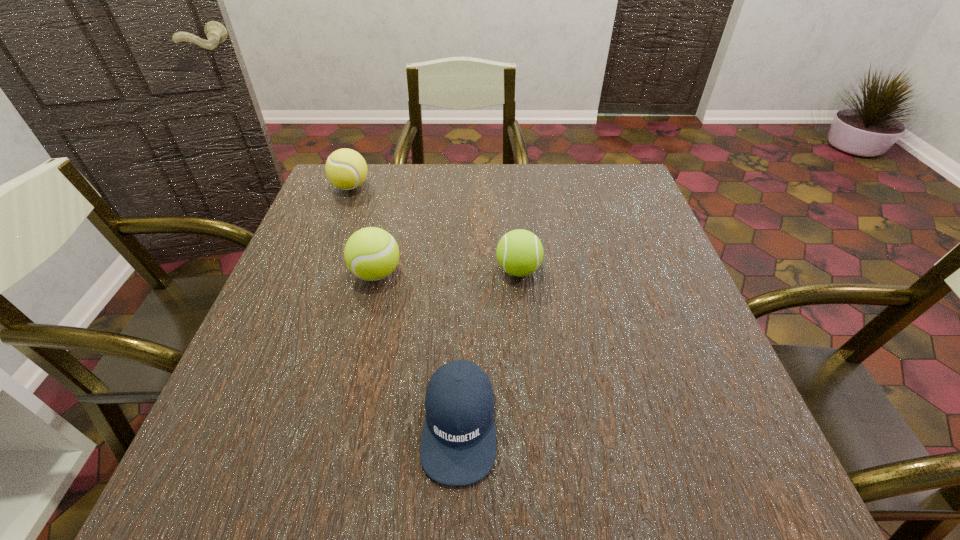
Image resolution: width=960 pixels, height=540 pixels. I want to click on object present at the near edge, so click(x=458, y=445).

Where is `object present at the far left corner`? This screenshot has height=540, width=960. object present at the far left corner is located at coordinates (346, 169).

Locate an element on the screen. This screenshot has width=960, height=540. free point at the far edge is located at coordinates pos(378,210).

Find the location of a particular element. This screenshot has width=960, height=540. vacant space at the near edge of the desktop is located at coordinates (594, 487).

Image resolution: width=960 pixels, height=540 pixels. What are the coordinates of `vacant space at the left edge of the desktop` in the screenshot? It's located at (272, 392).

In the image, there is a desktop. What are the coordinates of `blank space at the right edge` in the screenshot? It's located at (670, 313).

Locate an element on the screen. This screenshot has width=960, height=540. free space at the far left corner of the desktop is located at coordinates (335, 212).

In order to click on free space at the far right corner of the desktop in this screenshot , I will do `click(588, 199)`.

Where is `free space at the near right corner`? free space at the near right corner is located at coordinates (708, 457).

The image size is (960, 540). Find the location of `free space between the second tennis ball from right to left and the shortest object`. free space between the second tennis ball from right to left and the shortest object is located at coordinates (418, 349).